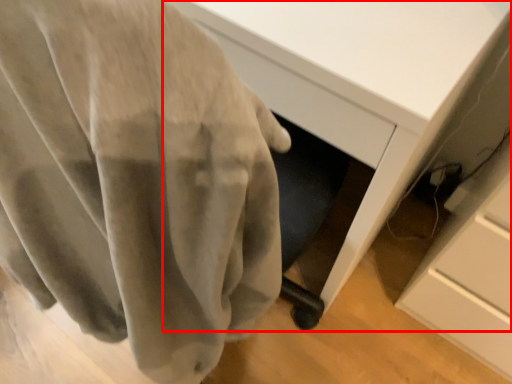
Question: Where is desk (annotated by the red box) located in relation to curtain in the image?

Choices:
 (A) left
 (B) right

Answer: (B)